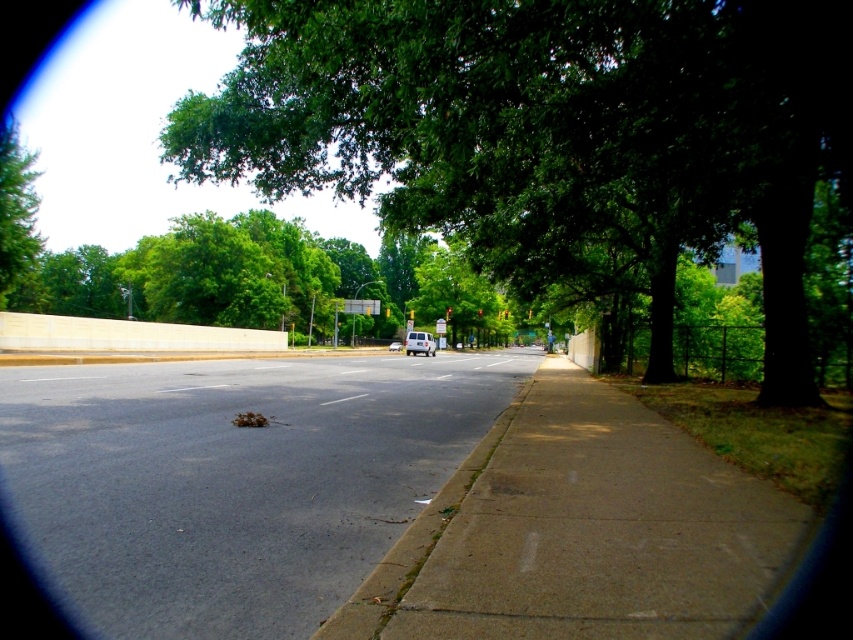
You are standing on the sidewalk and want to cross the dark asphalt road at center to reach the park on the other side. The park is directly across from where you are standing. Your wheelchair has a turning radius of 1.5 meters. Can you safely navigate around the white van driving away from you towards the center of the image?

The distance between you and the white van is 3.22 meters. Since your wheelchair requires a turning radius of 1.5 meters, you have enough space to safely navigate around the white van driving away from you towards the center of the image.

You are standing on the sidewalk and looking down the street. There is a white van driving away from you towards the center of the image. Where is the point at coordinates (233, 481) located?

The point at coordinates (233, 481) is located on the dark asphalt road at center.

You are a delivery person standing on the sidewalk. You need to walk past the green leafy tree at upper left and the white matte van at center to reach the destination. Which object will you pass first?

The green leafy tree at upper left will be passed first because it is positioned closer to the starting point on the sidewalk compared to the white matte van at center.